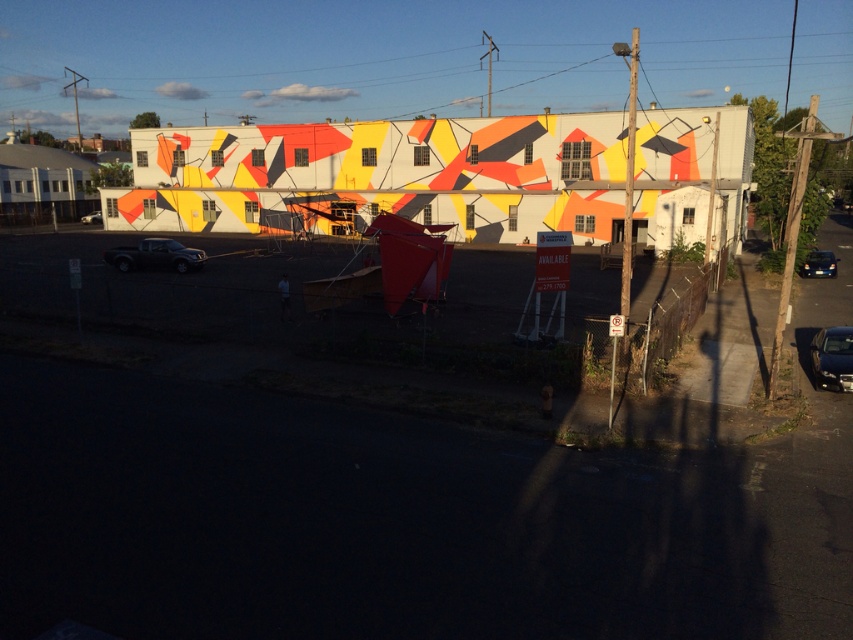
Looking at this image, you are standing at the point closest to the building in the scene. Which of the two points, point (143, 241) or point (90, 216), is closer to you?

Point (90, 216) is closer to you because it is behind point (143, 241), meaning you are closer to the latter point which is in front.